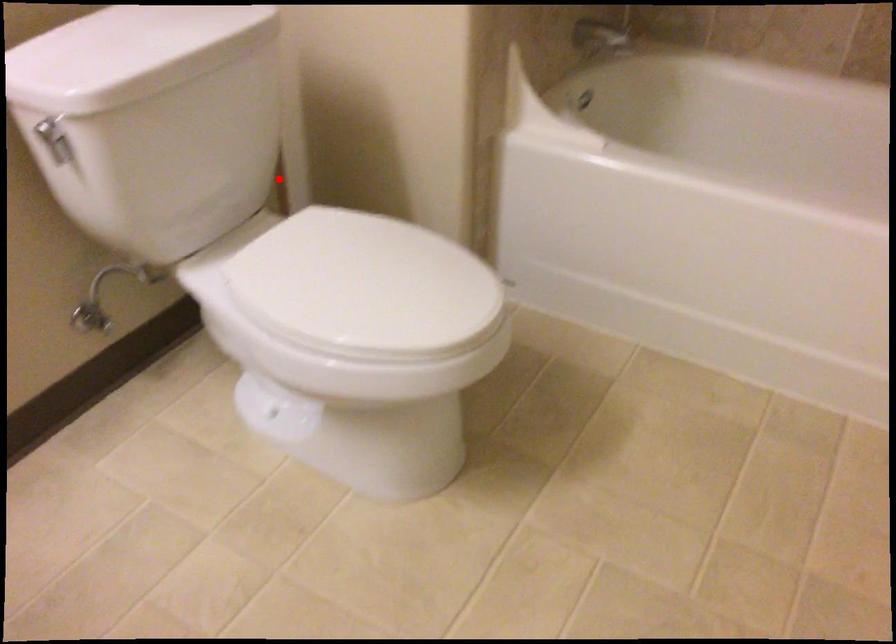
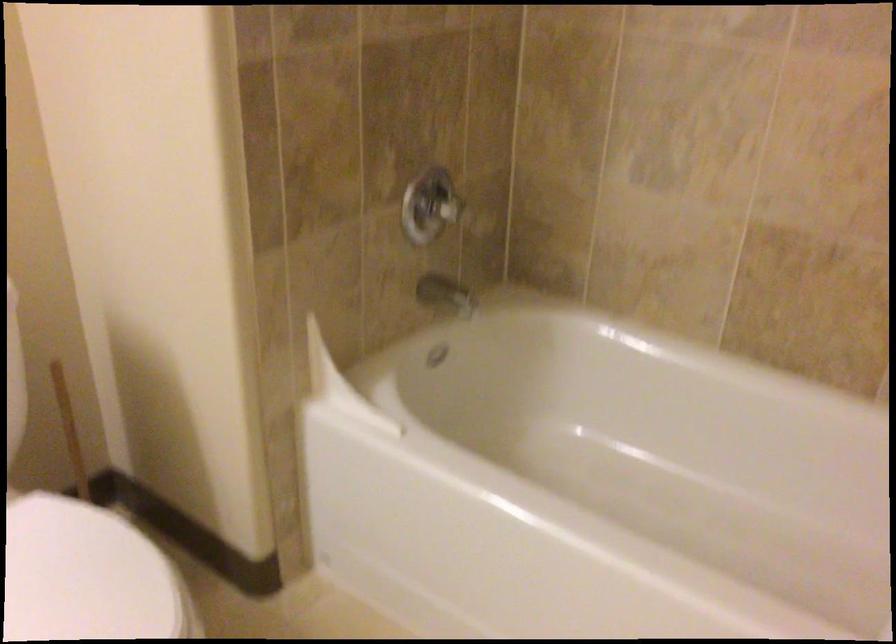
In the second image, find the point that corresponds to the highlighted location in the first image.

(72, 438)